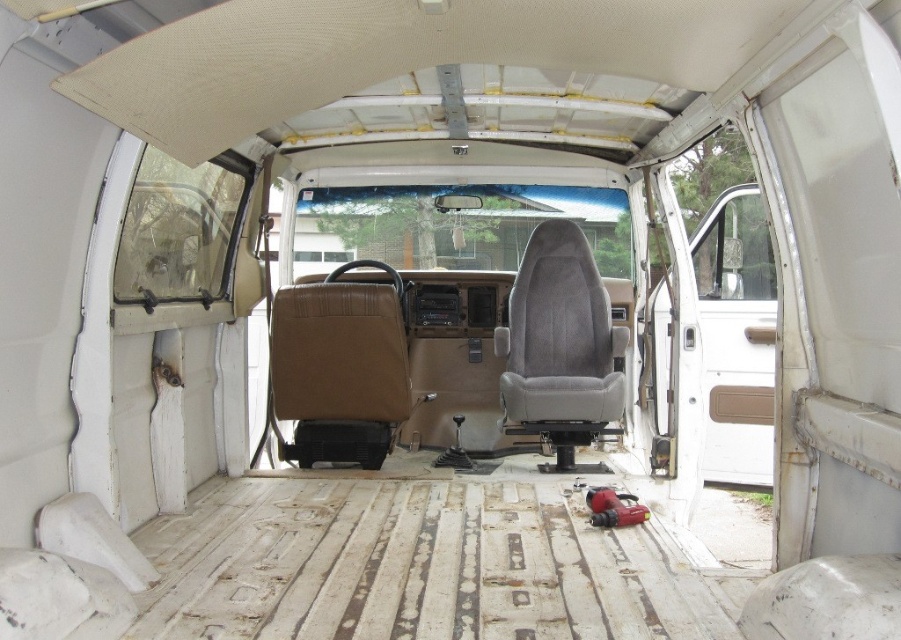
Who is lower down, brown leather seat at center or gray fabric seat at center?

brown leather seat at center

Is brown leather seat at center bigger than gray fabric seat at center?

No.

Is point (399, 305) positioned after point (575, 244)?

No.

This screenshot has width=901, height=640. I want to click on brown leather seat at center, so click(x=340, y=369).